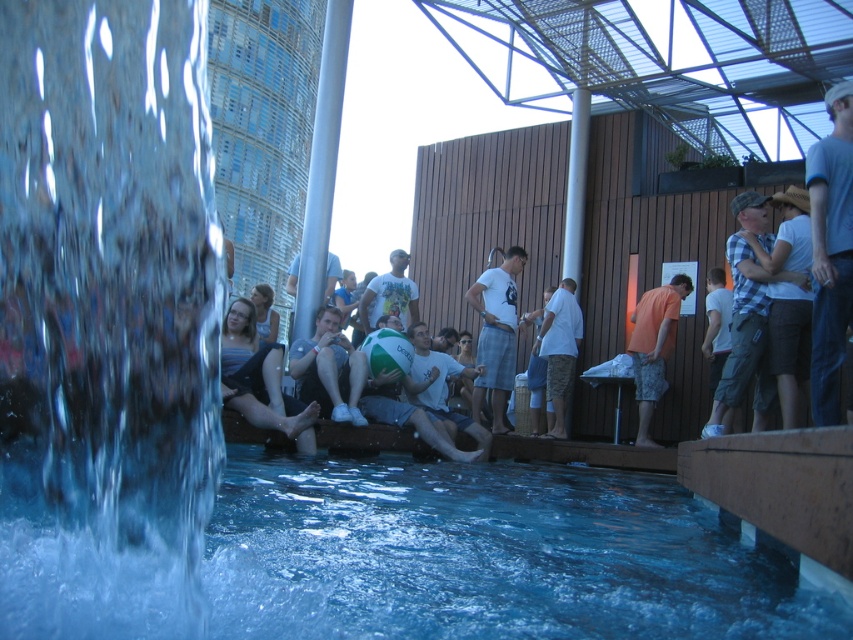
Does plaid shirt at center have a lesser height compared to blue denim shorts at lower left?

No, plaid shirt at center is not shorter than blue denim shorts at lower left.

Can you confirm if plaid shirt at center is positioned to the right of blue denim shorts at lower left?

Indeed, plaid shirt at center is positioned on the right side of blue denim shorts at lower left.

Between point (801, 252) and point (264, 346), which one is positioned in front?

Point (801, 252) is more forward.

Identify the location of plaid shirt at center. The width and height of the screenshot is (853, 640). (788, 346).

Is white cotton shirt at center smaller than light blue denim shorts at center?

No, white cotton shirt at center is not smaller than light blue denim shorts at center.

Who is positioned more to the left, white cotton shirt at center or light blue denim shorts at center?

Positioned to the left is light blue denim shorts at center.

Who is more distant from viewer, (572,360) or (276,314)?

Positioned behind is point (572,360).

Where is `white cotton shirt at center`? The image size is (853, 640). white cotton shirt at center is located at coordinates (560, 349).

Is clear liquid water at left to the left of plaid shirt at center from the viewer's perspective?

Correct, you'll find clear liquid water at left to the left of plaid shirt at center.

Does clear liquid water at left come in front of plaid shirt at center?

Yes.

What do you see at coordinates (105, 312) in the screenshot? This screenshot has height=640, width=853. I see `clear liquid water at left` at bounding box center [105, 312].

This screenshot has width=853, height=640. What are the coordinates of `clear liquid water at left` in the screenshot? It's located at (105, 312).